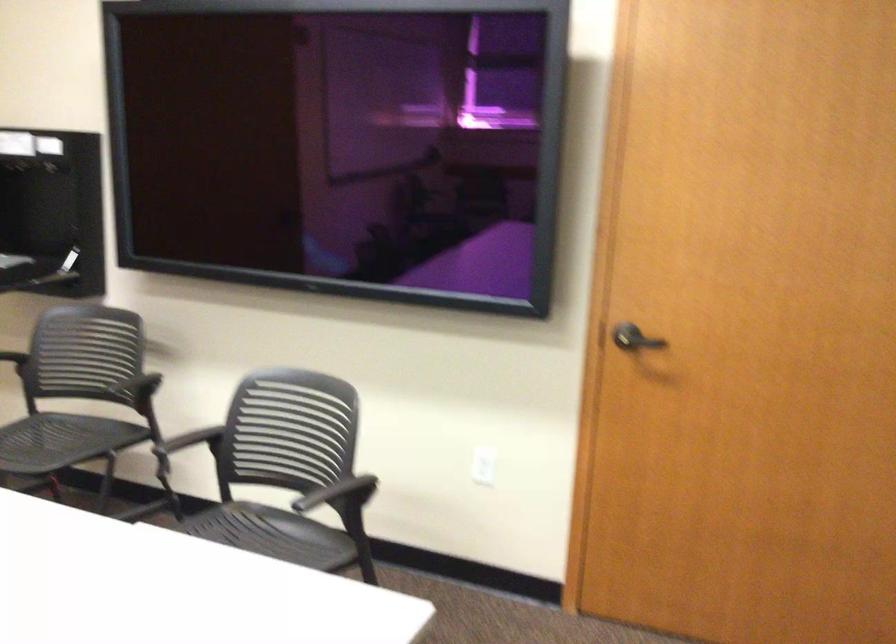
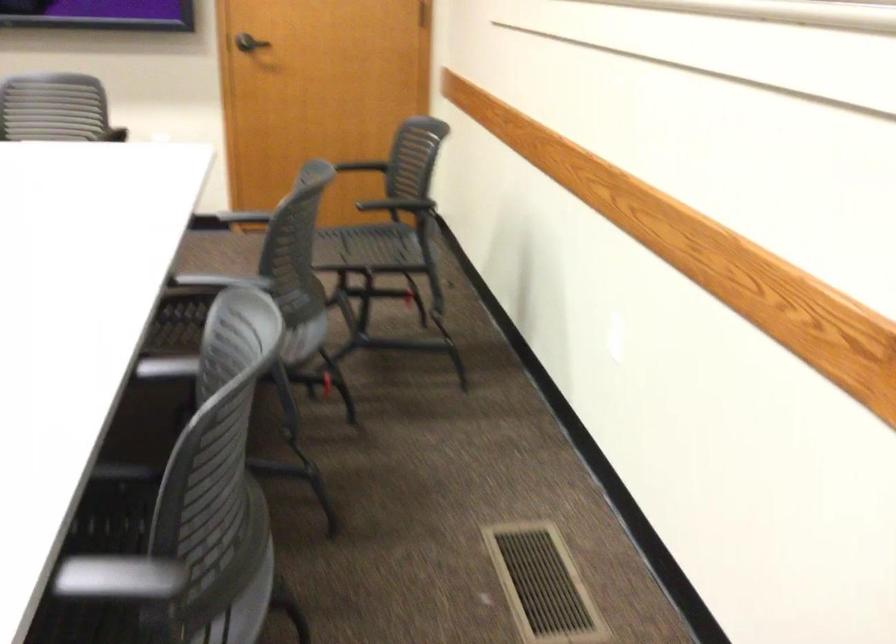
Find the pixel in the second image that matches pixel 627 339 in the first image.

(250, 43)